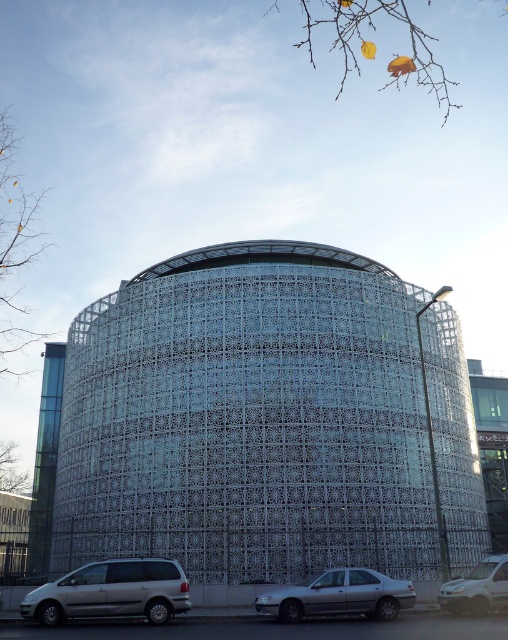
Question: Which object appears farthest from the camera in this image?

Choices:
 (A) silver metallic car at lower center
 (B) metallic grid structure at center
 (C) white matte van at lower right

Answer: (B)

Question: Is the position of silver metallic van at lower left more distant than that of silver metallic car at lower center?

Choices:
 (A) no
 (B) yes

Answer: (A)

Question: Which object appears closest to the camera in this image?

Choices:
 (A) silver metallic van at lower left
 (B) white matte van at lower right
 (C) silver metallic car at lower center

Answer: (A)

Question: Can you confirm if silver metallic car at lower center is wider than white matte van at lower right?

Choices:
 (A) no
 (B) yes

Answer: (B)

Question: Is metallic grid structure at center thinner than silver metallic van at lower left?

Choices:
 (A) yes
 (B) no

Answer: (B)

Question: Estimate the real-world distances between objects in this image. Which object is farther from the silver metallic car at lower center?

Choices:
 (A) metallic grid structure at center
 (B) white matte van at lower right

Answer: (A)